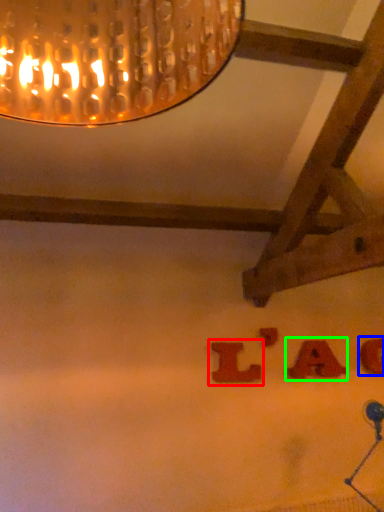
Question: Which is farther away from alphabet (highlighted by a red box)? alphabet (highlighted by a blue box) or alphabet (highlighted by a green box)?

Choices:
 (A) alphabet
 (B) alphabet

Answer: (A)